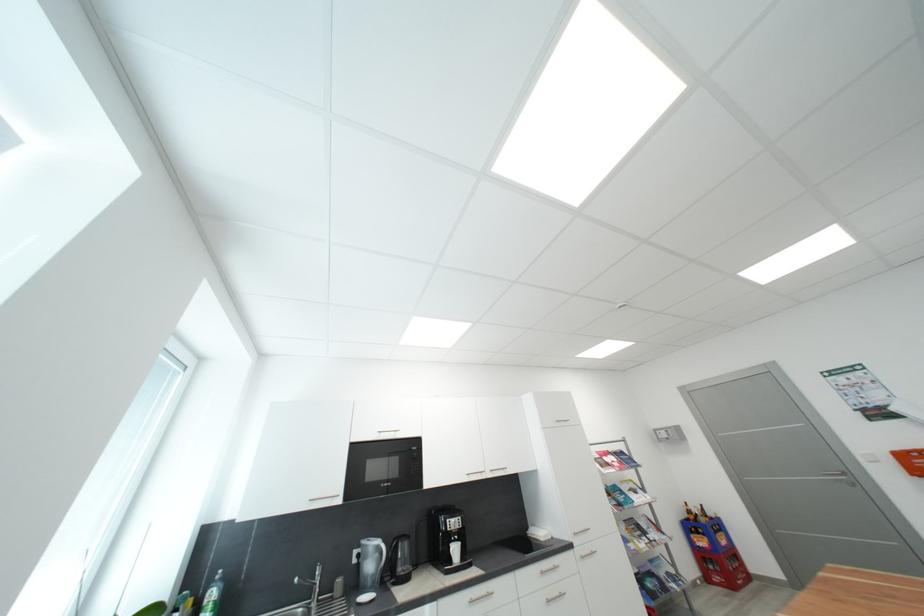
Describe the element at coordinates (455, 551) in the screenshot. I see `the silver kettle handle` at that location.